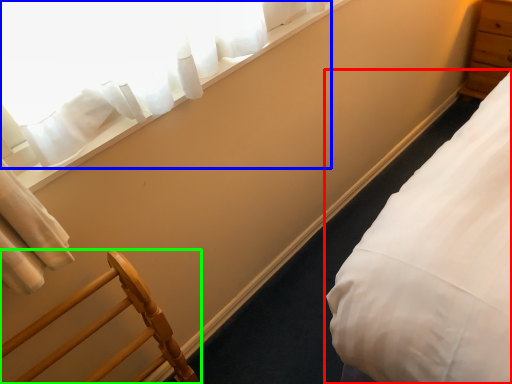
Question: Which is farther away from bed (highlighted by a red box)? curtain (highlighted by a blue box) or furniture (highlighted by a green box)?

Choices:
 (A) curtain
 (B) furniture

Answer: (A)